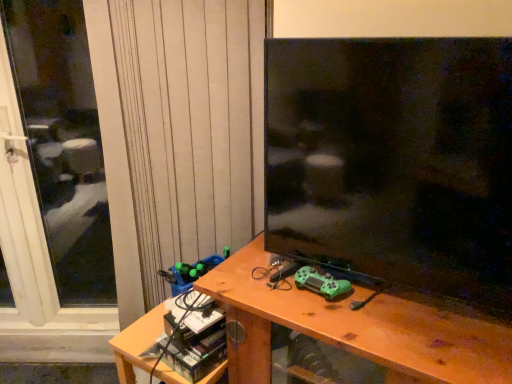
I want to click on free space that is to the left of green matte game controller at center, positioned as the 2th toy in back-to-front order, so pyautogui.click(x=266, y=289).